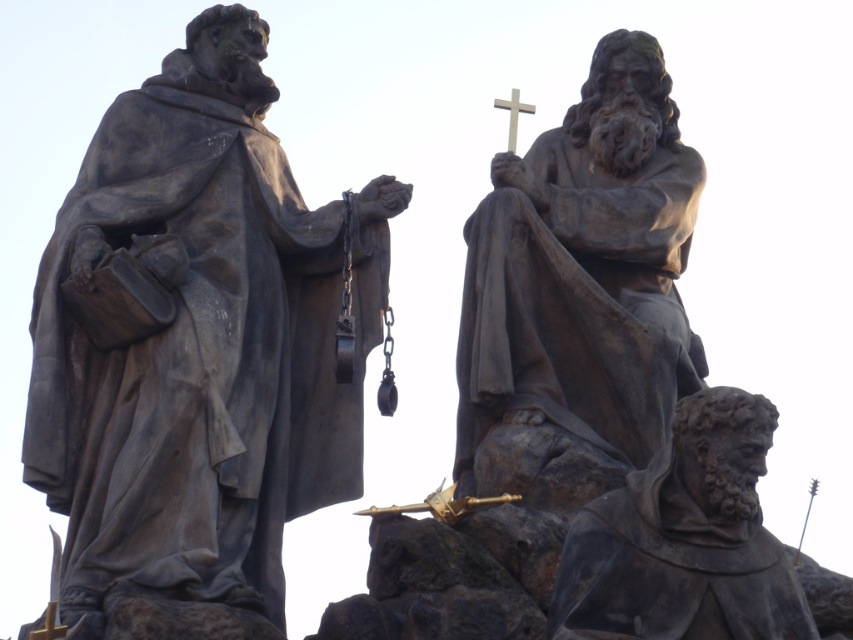
You are a visitor at a historical site and want to take a photo of the dark gray stone statue at lower right and the gold metallic crucifix at center. Which one should you focus on first if you want to capture both in the same frame without moving the camera?

The dark gray stone statue at lower right is much taller than the gold metallic crucifix at center, so you should focus on the dark gray stone statue at lower right first to ensure it fits in the frame.

You are standing in front of the three stone statues. You notice two points marked on the statues. One is at coordinates point (287, 372) and the other is at point (714, 561). Which point is closer to you?

Point (287, 372) is closer to you than point (714, 561).